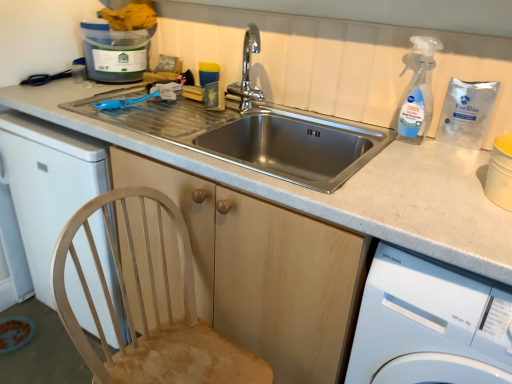
From the picture: In order to face blue plastic container at upper left, should I rotate leftwards or rightwards?

Turn left by 18.512 degrees to look at blue plastic container at upper left.

Measure the distance between transparent plastic spray bottle at upper right and camera.

A distance of 3.88 feet exists between transparent plastic spray bottle at upper right and camera.

Identify the location of stainless steel sink at center. This screenshot has height=384, width=512. (295, 145).

What do you see at coordinates (153, 308) in the screenshot? The image size is (512, 384). I see `natural wood chair at lower left` at bounding box center [153, 308].

This screenshot has width=512, height=384. In order to click on blue plastic container at upper left in this screenshot , I will do `click(115, 53)`.

This screenshot has width=512, height=384. I want to click on cabinetry that appears above the natural wood chair at lower left (from a real-world perspective), so point(262,271).

From the picture: Is natural wood chair at lower left behind wooden cabinet at center?

No, it is in front of wooden cabinet at center.

Is natural wood chair at lower left to the left or to the right of wooden cabinet at center in the image?

natural wood chair at lower left is to the left of wooden cabinet at center.

Who is bigger, wooden cabinet at center or stainless steel sink at center?

Bigger between the two is wooden cabinet at center.

Which point is more forward, (318, 306) or (220, 152)?

The point (318, 306) is closer to the camera.

In the scene shown: Is stainless steel sink at center at the back of wooden cabinet at center?

No.

Consider the image. In terms of width, does transparent plastic spray bottle at upper right look wider or thinner when compared to wooden cabinet at center?

In the image, transparent plastic spray bottle at upper right appears to be more narrow than wooden cabinet at center.

You are a GUI agent. You are given a task and a screenshot of the screen. Output one action in this format:
    pyautogui.click(x=<x>, y=<y>)
    Task: Click on the cabinetry below the transparent plastic spray bottle at upper right (from a real-world perspective)
    The width and height of the screenshot is (512, 384).
    Given the screenshot: What is the action you would take?
    pyautogui.click(x=262, y=271)

Which is behind, point (412, 40) or point (225, 245)?

The point (412, 40) is farther.

The image size is (512, 384). I want to click on washing machine to the right of stainless steel sink at center, so click(429, 325).

Does white glossy washing machine at lower right appear on the left side of stainless steel sink at center?

In fact, white glossy washing machine at lower right is to the right of stainless steel sink at center.

From a real-world perspective, is white glossy washing machine at lower right beneath stainless steel sink at center?

Correct, in the physical world, white glossy washing machine at lower right is lower than stainless steel sink at center.

Is white glossy washing machine at lower right thinner than stainless steel sink at center?

In fact, white glossy washing machine at lower right might be wider than stainless steel sink at center.

You are a GUI agent. You are given a task and a screenshot of the screen. Output one action in this format:
    pyautogui.click(x=<x>, y=<y>)
    Task: Click on the washing machine below the wooden cabinet at center (from a real-world perspective)
    The width and height of the screenshot is (512, 384).
    Given the screenshot: What is the action you would take?
    pyautogui.click(x=429, y=325)

Between wooden cabinet at center and white glossy washing machine at lower right, which one has smaller size?

With smaller size is white glossy washing machine at lower right.

Is wooden cabinet at center directly adjacent to white glossy washing machine at lower right?

No, wooden cabinet at center is not beside white glossy washing machine at lower right.

From the image's perspective, would you say wooden cabinet at center is shown under white glossy washing machine at lower right?

Incorrect, from the image's perspective, wooden cabinet at center is higher than white glossy washing machine at lower right.

Which object is more forward, wooden cabinet at center or blue plastic container at upper left?

wooden cabinet at center is more forward.

Is wooden cabinet at center aimed at blue plastic container at upper left?

No, wooden cabinet at center is not oriented towards blue plastic container at upper left.

Is wooden cabinet at center wider than blue plastic container at upper left?

Indeed, wooden cabinet at center has a greater width compared to blue plastic container at upper left.

Between wooden cabinet at center and blue plastic container at upper left, which one has larger size?

With larger size is wooden cabinet at center.

In terms of height, does natural wood chair at lower left look taller or shorter compared to white glossy washing machine at lower right?

natural wood chair at lower left is shorter than white glossy washing machine at lower right.

Considering the positions of objects natural wood chair at lower left and white glossy washing machine at lower right in the image provided, who is more to the right, natural wood chair at lower left or white glossy washing machine at lower right?

From the viewer's perspective, white glossy washing machine at lower right appears more on the right side.

Is point (187, 296) more distant than point (439, 275)?

Yes, point (187, 296) is behind point (439, 275).

From the picture: Measure the distance between natural wood chair at lower left and white glossy washing machine at lower right.

19.88 inches.

The width and height of the screenshot is (512, 384). What are the coordinates of `cabinetry that appears on the right of natural wood chair at lower left` in the screenshot? It's located at (262, 271).

I want to click on cabinetry in front of the stainless steel sink at center, so pos(262,271).

Considering their positions, is white glossy washing machine at lower right positioned further to blue plastic container at upper left than transparent plastic spray bottle at upper right?

white glossy washing machine at lower right lies further to blue plastic container at upper left than the other object.

Based on their spatial positions, is white glossy washing machine at lower right or stainless steel sink at center further from natural wood chair at lower left?

white glossy washing machine at lower right is further to natural wood chair at lower left.

Based on their spatial positions, is blue plastic container at upper left or stainless steel sink at center further from transparent plastic spray bottle at upper right?

blue plastic container at upper left lies further to transparent plastic spray bottle at upper right than the other object.

From the image, which object appears to be nearer to natural wood chair at lower left, wooden cabinet at center or blue plastic container at upper left?

The object closer to natural wood chair at lower left is wooden cabinet at center.

Looking at the image, which one is located closer to natural wood chair at lower left, transparent plastic spray bottle at upper right or wooden cabinet at center?

wooden cabinet at center lies closer to natural wood chair at lower left than the other object.

Estimate the real-world distances between objects in this image. Which object is closer to white glossy washing machine at lower right, natural wood chair at lower left or transparent plastic spray bottle at upper right?

natural wood chair at lower left.

Which object lies nearer to the anchor point wooden cabinet at center, white glossy washing machine at lower right or natural wood chair at lower left?

The object closer to wooden cabinet at center is natural wood chair at lower left.

Consider the image. Considering their positions, is transparent plastic spray bottle at upper right positioned closer to white glossy washing machine at lower right than blue plastic container at upper left?

transparent plastic spray bottle at upper right lies closer to white glossy washing machine at lower right than the other object.

At what (x,y) coordinates should I click in order to perform the action: click on sink between transparent plastic spray bottle at upper right and white glossy washing machine at lower right from top to bottom. Please return your answer as a coordinate pair (x, y). This screenshot has width=512, height=384. Looking at the image, I should click on (295, 145).

Locate an element on the screen. sink situated between blue plastic container at upper left and white glossy washing machine at lower right from left to right is located at coordinates (295, 145).

Find the location of a particular element. The width and height of the screenshot is (512, 384). cleaning product located between blue plastic container at upper left and white glossy washing machine at lower right in the left-right direction is located at coordinates coord(417,94).

Where is `sink between transparent plastic spray bottle at upper right and natural wood chair at lower left in the up-down direction`? sink between transparent plastic spray bottle at upper right and natural wood chair at lower left in the up-down direction is located at coordinates (295, 145).